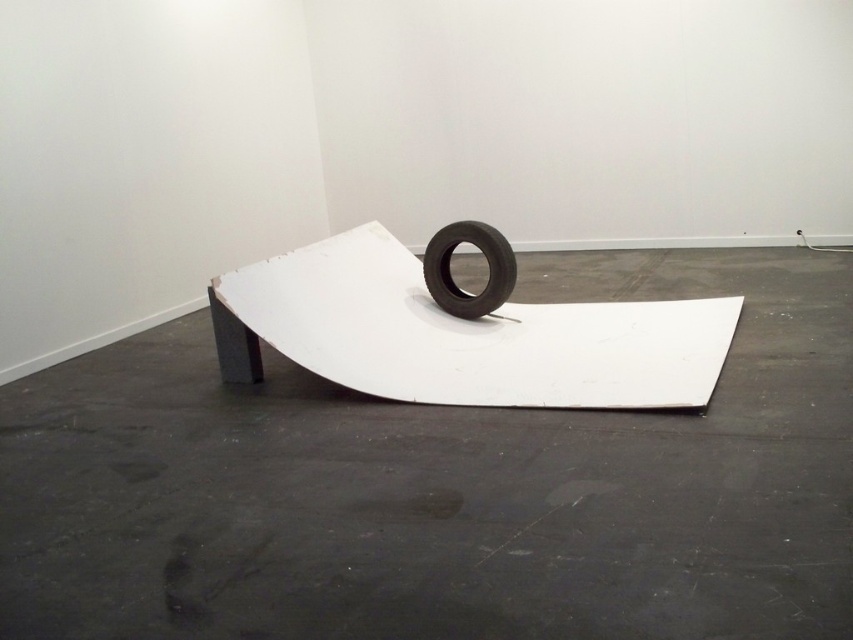
You are standing in the art installation room. You need to place a new sculpture exactly at the point marked as point (465, 330). Which object is located at that point?

The white matte ramp at center is located at point (465, 330).

You are an artist standing in front of the white matte ramp at center and the black rubber tire at center. You want to place a small sculpture exactly halfway between them. Which object should you use as your starting point to measure the distance?

Since the white matte ramp at center is closer to the viewer than the black rubber tire at center, you should start measuring from the white matte ramp at center to ensure the sculpture is placed halfway between them.